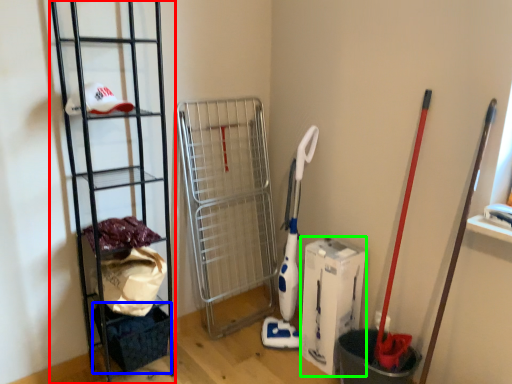
Question: Based on their relative distances, which object is nearer to ladder (highlighted by a red box)? Choose from basket (highlighted by a blue box) and box (highlighted by a green box).

Choices:
 (A) basket
 (B) box

Answer: (A)